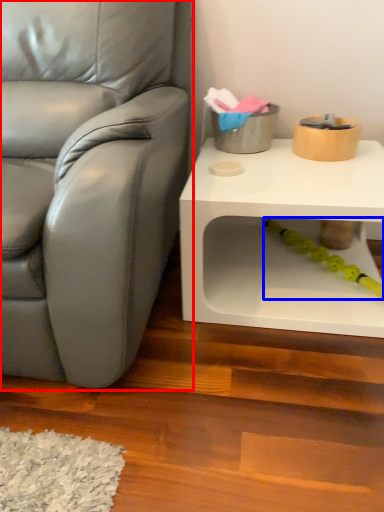
Question: Which object is further to the camera taking this photo, chair (highlighted by a red box) or toy (highlighted by a blue box)?

Choices:
 (A) chair
 (B) toy

Answer: (B)